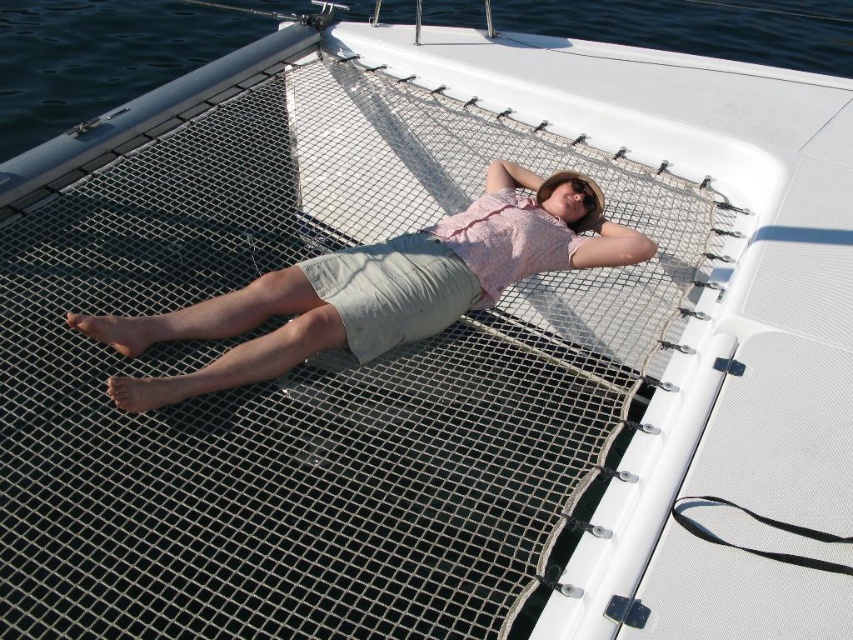
Between pink fabric shirt at center and transparent water at upper left, which one is positioned lower?

pink fabric shirt at center is below.

Who is higher up, pink fabric shirt at center or transparent water at upper left?

Positioned higher is transparent water at upper left.

Is point (618, 236) positioned behind point (822, 36)?

No, (618, 236) is closer to viewer.

At what (x,y) coordinates should I click in order to perform the action: click on pink fabric shirt at center. Please return your answer as a coordinate pair (x, y). Looking at the image, I should click on (380, 285).